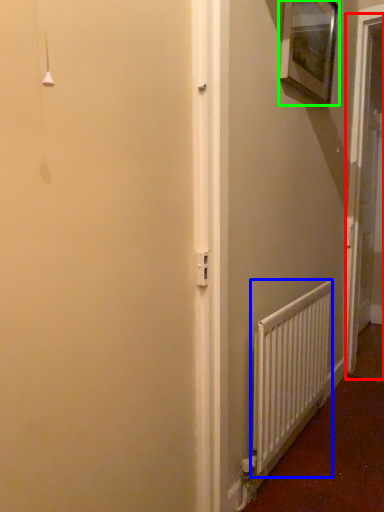
Question: Estimate the real-world distances between objects in this image. Which object is closer to screen door (highlighted by a red box), radiator (highlighted by a blue box) or picture frame (highlighted by a green box)?

Choices:
 (A) radiator
 (B) picture frame

Answer: (B)